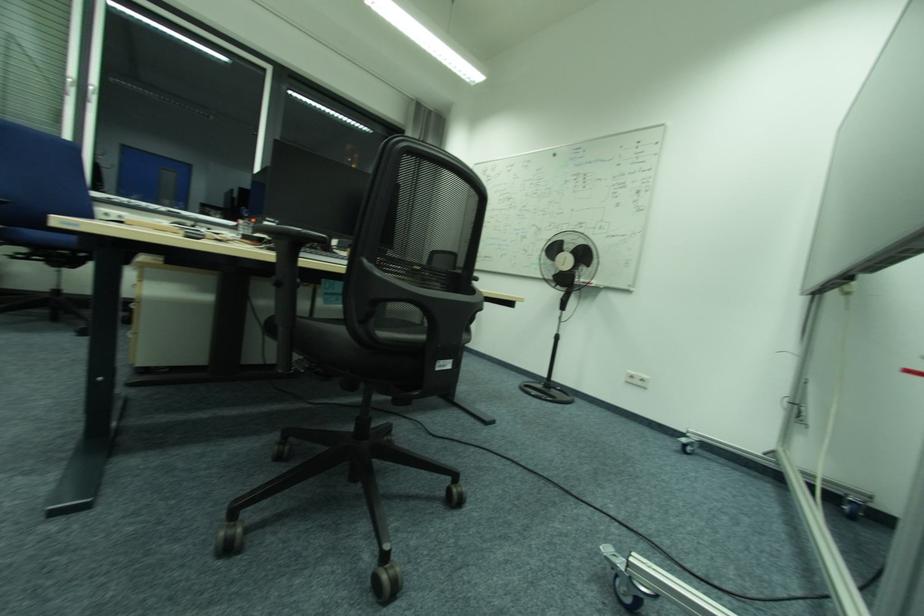
Find where to sit the black chair sitting surface. Please return your answer as a coordinate pair (x, y).

(325, 313)